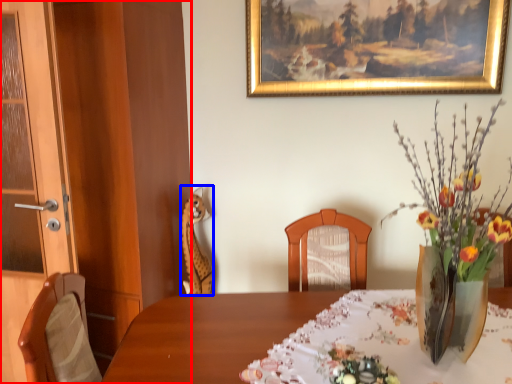
Question: Which point is further to the camera, dresser (highlighted by a red box) or animal (highlighted by a blue box)?

Choices:
 (A) dresser
 (B) animal

Answer: (B)